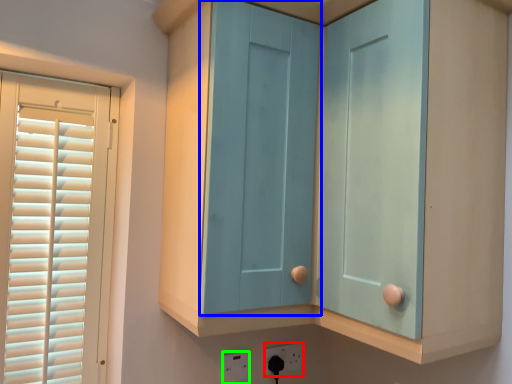
Question: Considering the real-world distances, which object is farthest from electric outlet (highlighted by a red box)? screen door (highlighted by a blue box) or electric outlet (highlighted by a green box)?

Choices:
 (A) screen door
 (B) electric outlet

Answer: (A)